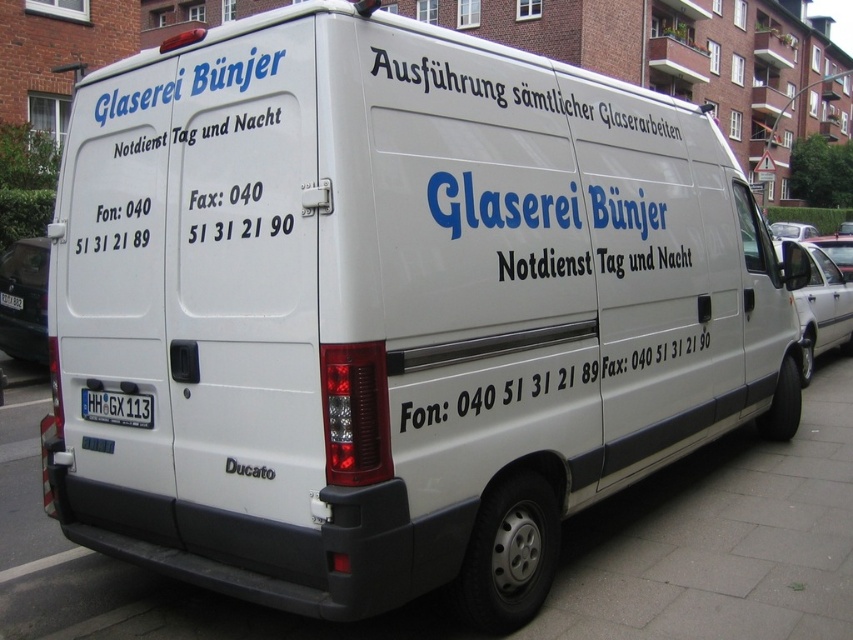
Is black text at upper center smaller than white vinyl text at center?

Correct, black text at upper center occupies less space than white vinyl text at center.

Can you confirm if black text at upper center is positioned to the left of white vinyl text at center?

Indeed, black text at upper center is positioned on the left side of white vinyl text at center.

Find the location of a particular element. black text at upper center is located at coordinates (505, 92).

Is black text at upper center further to camera compared to white plastic license plate at rear?

No, it is in front of white plastic license plate at rear.

Is point (576, 108) more distant than point (0, 292)?

No, (576, 108) is closer to viewer.

Where is `black text at upper center`? This screenshot has height=640, width=853. black text at upper center is located at coordinates (505, 92).

Who is shorter, white plastic license plate at lower center or white plastic license plate at rear?

With less height is white plastic license plate at lower center.

In order to click on white plastic license plate at lower center in this screenshot , I will do `click(117, 406)`.

This screenshot has height=640, width=853. I want to click on white plastic license plate at lower center, so click(x=117, y=406).